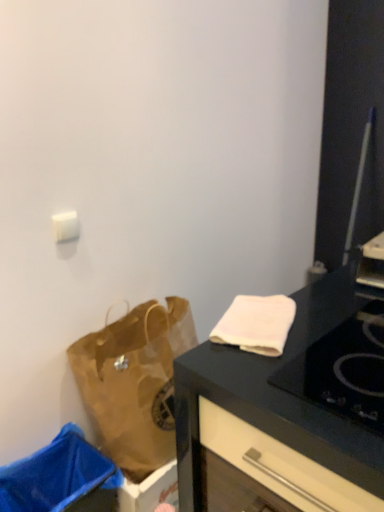
Question: Considering the relative positions of blue plastic trash bin at lower left and white soft towel at upper right in the image provided, is blue plastic trash bin at lower left to the left or to the right of white soft towel at upper right?

Choices:
 (A) right
 (B) left

Answer: (B)

Question: Considering their positions, is blue plastic trash bin at lower left located in front of or behind white soft towel at upper right?

Choices:
 (A) front
 (B) behind

Answer: (B)

Question: Estimate the real-world distances between objects in this image. Which object is closer to the blue plastic trash bin at lower left?

Choices:
 (A) brown paper bag at lower left
 (B) white soft towel at upper right
 (C) black glass gas stove at upper right

Answer: (A)

Question: Which is nearer to the blue plastic trash bin at lower left?

Choices:
 (A) brown paper bag at lower left
 (B) black glass gas stove at upper right
 (C) white soft towel at upper right

Answer: (A)